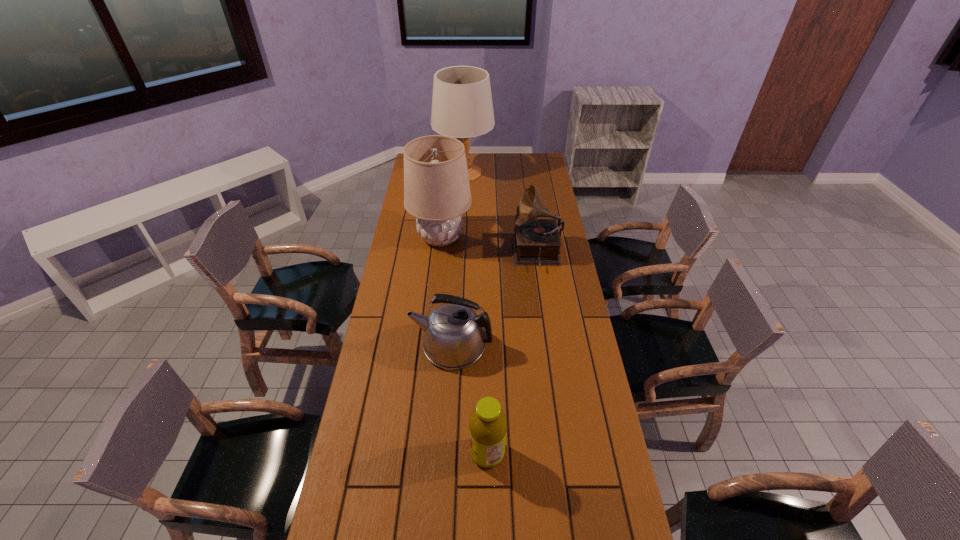
Image resolution: width=960 pixels, height=540 pixels. Identify the location of vacant space located 0.120m from the horn of the rightmost object. (486, 254).

The width and height of the screenshot is (960, 540). I want to click on vacant point located 0.100m from the horn of the rightmost object, so click(x=490, y=254).

At what (x,y) coordinates should I click in order to perform the action: click on free region located on the spout of the second nearest object. Please return your answer as a coordinate pair (x, y). The width and height of the screenshot is (960, 540). Looking at the image, I should click on (393, 346).

I want to click on free space located on the front label of the fruit juice, so pyautogui.click(x=436, y=453).

Locate an element on the screen. This screenshot has width=960, height=540. free space located 0.120m on the front label of the fruit juice is located at coordinates (429, 453).

Find the location of a particular element. This screenshot has height=540, width=960. vacant area located on the front label of the fruit juice is located at coordinates (409, 453).

The image size is (960, 540). I want to click on object at the far edge, so click(462, 107).

This screenshot has width=960, height=540. Identify the location of table lamp present at the left edge. (462, 107).

Locate an element on the screen. The height and width of the screenshot is (540, 960). lampshade at the left edge is located at coordinates (437, 193).

You are a GUI agent. You are given a task and a screenshot of the screen. Output one action in this format:
    pyautogui.click(x=<x>, y=<y>)
    Task: Click on the kettle located at the left edge
    
    Given the screenshot: What is the action you would take?
    pyautogui.click(x=454, y=338)